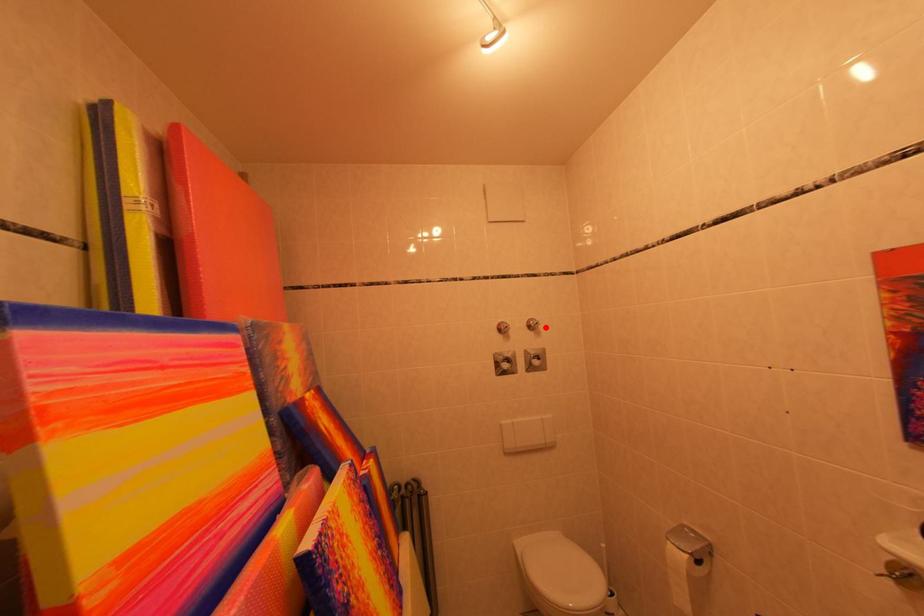
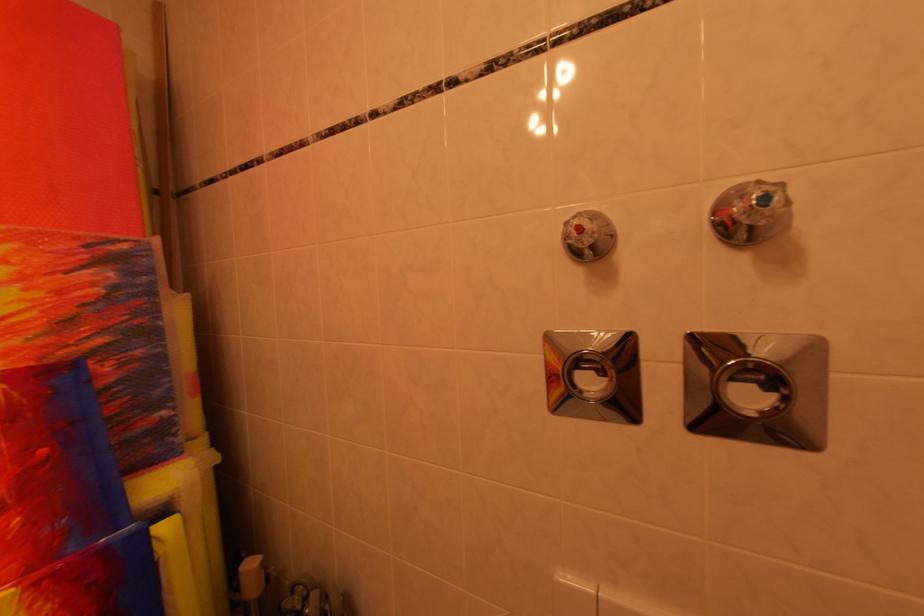
In the second image, find the point that corresponds to the highlighted location in the first image.

(773, 201)